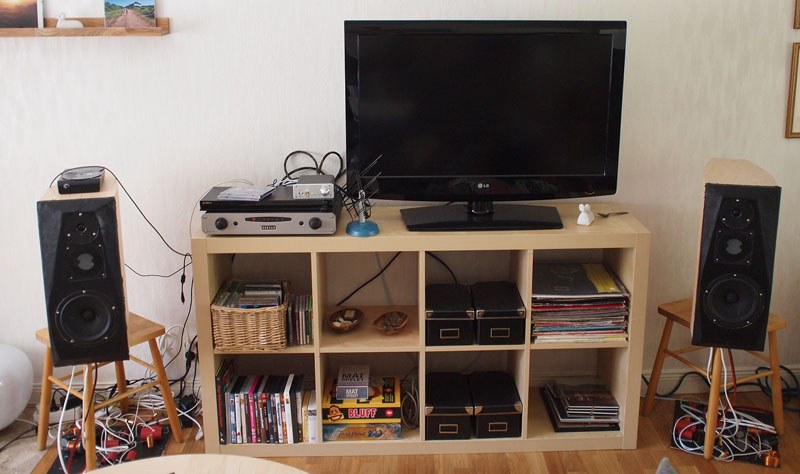
Identify the location of albums. (578, 318).